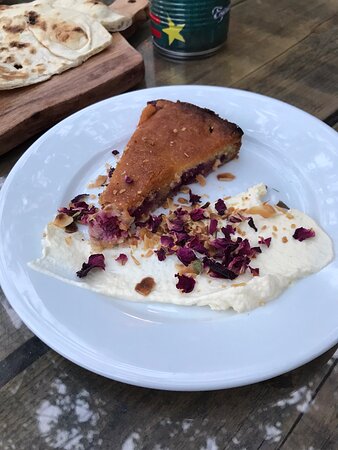
Find the location of a particular element. This screenshot has height=450, width=338. wooden chopping board is located at coordinates (88, 75).